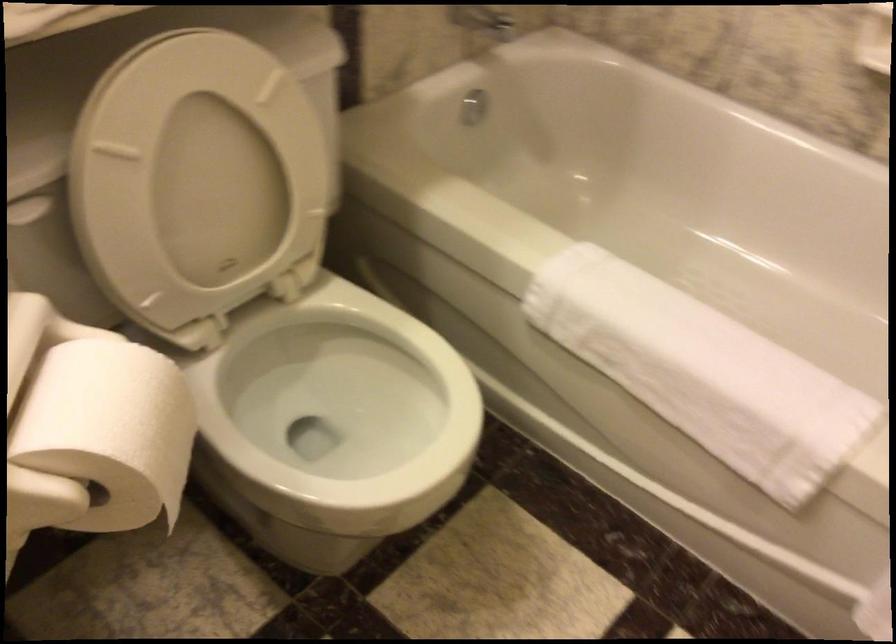
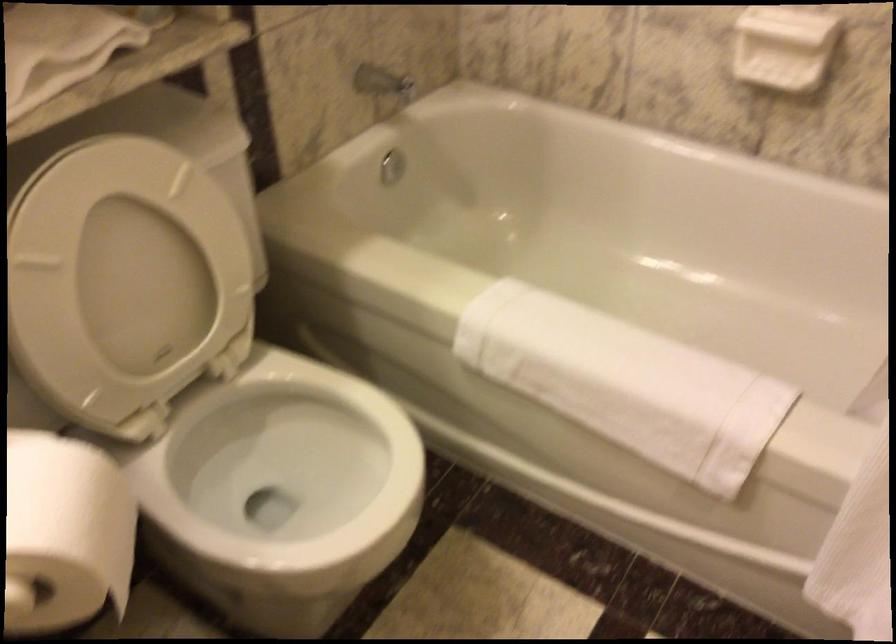
In the second image, find the point that corresponds to point (126, 437) in the first image.

(64, 534)